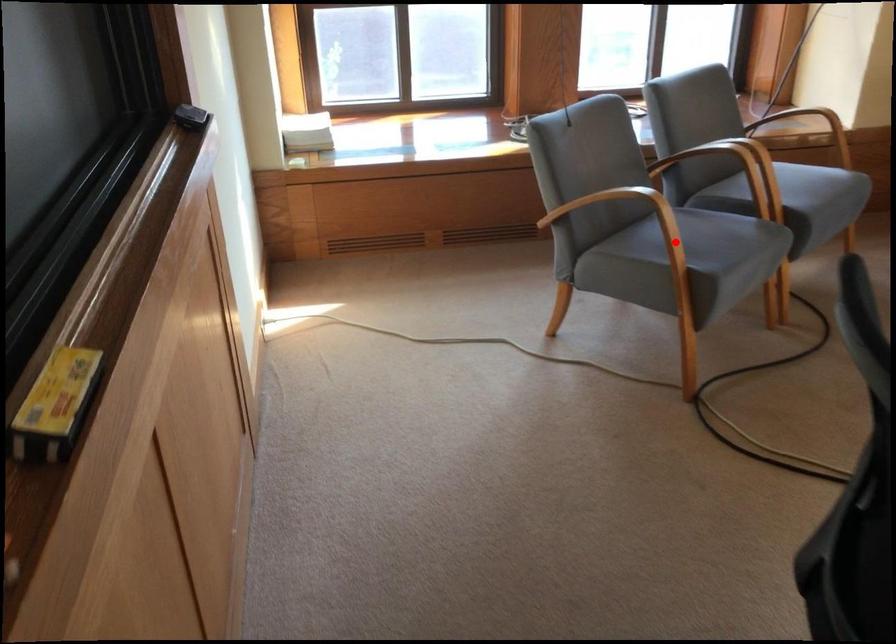
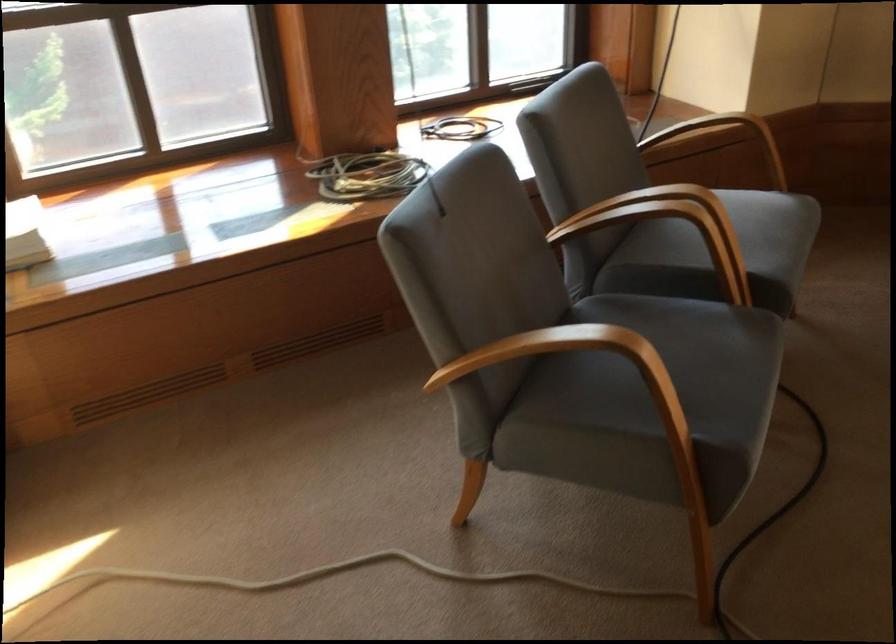
Question: I am providing you with two images of the same scene from different viewpoints. In image1, a red point is highlighted. Considering the same 3D point in image2, which of the following is correct?

Choices:
 (A) It is closer
 (B) It is farther

Answer: (A)